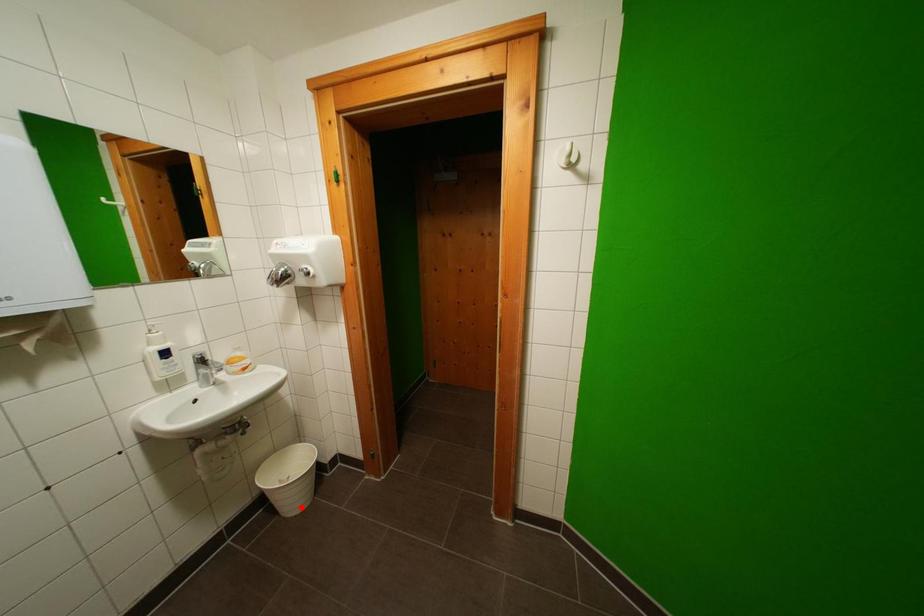
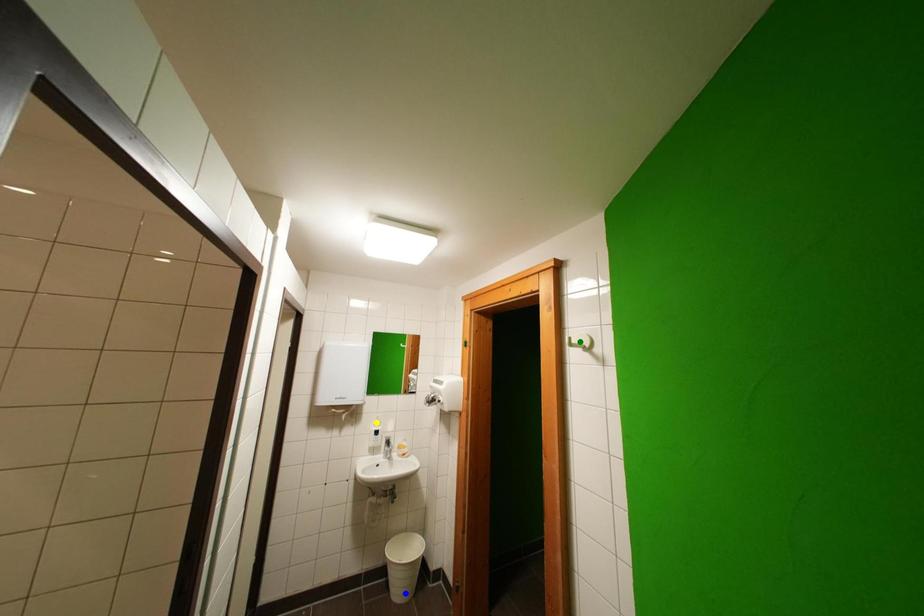
Question: I am providing you with two images of the same scene from different viewpoints. A red point is marked on the first image. You are given multiple points on the second image. Which mark in image 2 goes with the point in image 1?

Choices:
 (A) yellow point
 (B) blue point
 (C) green point

Answer: (B)